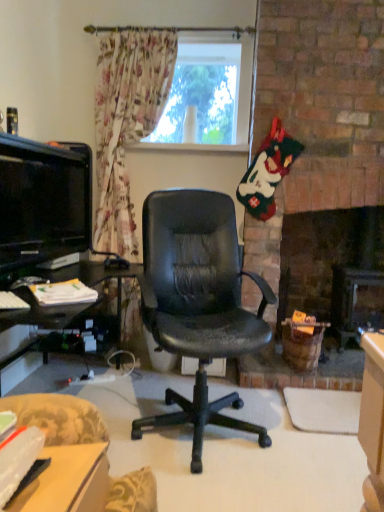
Question: Can you see transparent glass window at upper center touching matte black tv at left?

Choices:
 (A) yes
 (B) no

Answer: (B)

Question: Does transparent glass window at upper center have a lesser width compared to matte black tv at left?

Choices:
 (A) yes
 (B) no

Answer: (A)

Question: Can we say transparent glass window at upper center lies outside matte black tv at left?

Choices:
 (A) no
 (B) yes

Answer: (B)

Question: From a real-world perspective, is transparent glass window at upper center on matte black tv at left?

Choices:
 (A) no
 (B) yes

Answer: (B)

Question: Considering the relative positions of transparent glass window at upper center and matte black tv at left in the image provided, is transparent glass window at upper center to the right of matte black tv at left from the viewer's perspective?

Choices:
 (A) no
 (B) yes

Answer: (B)

Question: Is transparent glass window at upper center positioned with its back to matte black tv at left?

Choices:
 (A) no
 (B) yes

Answer: (A)

Question: Is transparent glass window at upper center a part of matte black tv at left?

Choices:
 (A) no
 (B) yes

Answer: (A)

Question: Does matte black tv at left turn towards transparent glass window at upper center?

Choices:
 (A) yes
 (B) no

Answer: (B)

Question: From the image's perspective, is matte black tv at left on top of transparent glass window at upper center?

Choices:
 (A) yes
 (B) no

Answer: (B)

Question: Can you confirm if matte black tv at left is taller than transparent glass window at upper center?

Choices:
 (A) no
 (B) yes

Answer: (A)

Question: Does matte black tv at left have a larger size compared to transparent glass window at upper center?

Choices:
 (A) no
 (B) yes

Answer: (A)

Question: Does matte black tv at left have a greater width compared to transparent glass window at upper center?

Choices:
 (A) no
 (B) yes

Answer: (B)

Question: From the image's perspective, is matte plastic desk at lower left on top of transparent glass window at upper center?

Choices:
 (A) no
 (B) yes

Answer: (A)